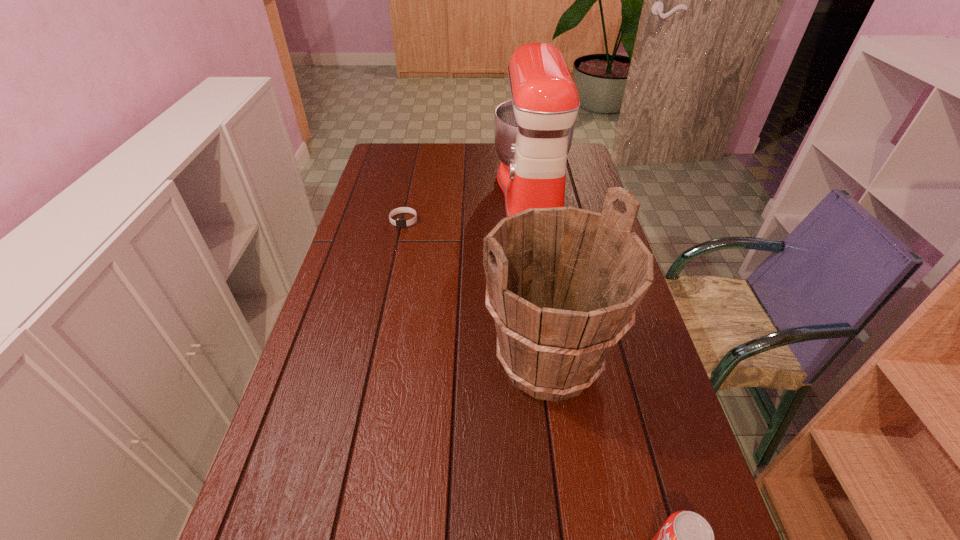
At what (x,y) coordinates should I click in order to perform the action: click on object present at the left edge. Please return your answer as a coordinate pair (x, y). The image size is (960, 540). Looking at the image, I should click on (399, 223).

Locate an element on the screen. The height and width of the screenshot is (540, 960). mixer situated at the right edge is located at coordinates (533, 132).

The image size is (960, 540). What are the coordinates of `bucket that is positioned at the right edge` in the screenshot? It's located at (562, 284).

At what (x,y) coordinates should I click in order to perform the action: click on object positioned at the far right corner. Please return your answer as a coordinate pair (x, y). This screenshot has width=960, height=540. Looking at the image, I should click on (533, 132).

At what (x,y) coordinates should I click in order to perform the action: click on free space at the left edge of the desktop. Please return your answer as a coordinate pair (x, y). Looking at the image, I should click on (389, 220).

The width and height of the screenshot is (960, 540). In order to click on free region at the right edge of the desktop in this screenshot , I will do `click(593, 211)`.

In the image, there is a desktop. At what (x,y) coordinates should I click in order to perform the action: click on vacant region at the far left corner. Please return your answer as a coordinate pair (x, y). Image resolution: width=960 pixels, height=540 pixels. Looking at the image, I should click on (407, 159).

What are the coordinates of `free spot between the leftmost object and the bucket` in the screenshot? It's located at (476, 291).

Identify which object is located as the second nearest to the bucket. Please provide its 2D coordinates. Your answer should be formatted as a tuple, i.e. [(x, y)], where the tuple contains the x and y coordinates of a point satisfying the conditions above.

[(533, 132)]

Locate an element on the screen. The image size is (960, 540). object that is the third closest to the bucket is located at coordinates (399, 223).